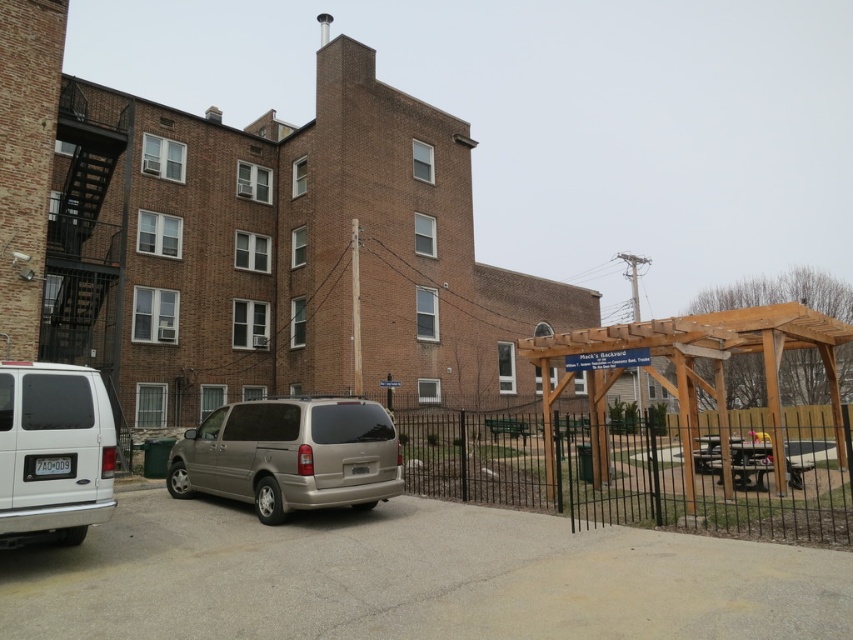
You are a delivery person trying to park your truck in the parking lot. You see the black metal fence at lower right and the white matte van at lower left. Which object is closer to the entrance of the parking lot?

The white matte van at lower left is closer to the entrance of the parking lot because it is positioned to the left of the black metal fence at lower right.

You are a delivery person driving a truck that is 10 meters long. You arrive at the residential area and want to park your truck between the black metal fence at lower right and the white matte van at lower left. Is there enough space between them to park your truck?

The black metal fence at lower right and white matte van at lower left are 9.57 meters apart. Since your truck is 10 meters long, there isn not enough space to park between them as the distance is shorter than the truck.